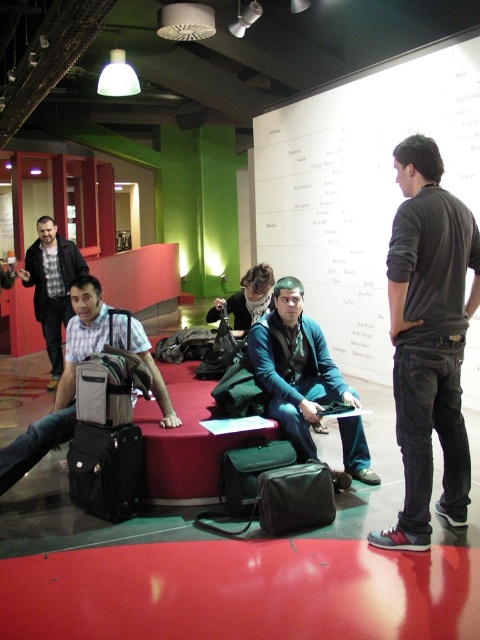
Question: Is teal fabric jacket at center smaller than plaid shirt at left?

Choices:
 (A) no
 (B) yes

Answer: (B)

Question: Which point is closer to the camera?

Choices:
 (A) dark green fabric bag at center
 (B) matte black suitcase at left
 (C) white paperboard at upper center
 (D) matte gray backpack at left

Answer: (A)

Question: Which object is closer to the camera taking this photo?

Choices:
 (A) matte gray backpack at left
 (B) dark green fabric bag at center
 (C) matte black suitcase at left

Answer: (B)

Question: Which of the following is the farthest from the observer?

Choices:
 (A) (68, 348)
 (B) (284, 205)
 (C) (241, 513)
 (D) (277, 499)

Answer: (B)

Question: Can you confirm if matte black suitcase at left is smaller than dark green fabric bag at center?

Choices:
 (A) no
 (B) yes

Answer: (A)

Question: Where is teal fabric jacket at center located in relation to dark green fabric bag at center in the image?

Choices:
 (A) above
 (B) below

Answer: (A)